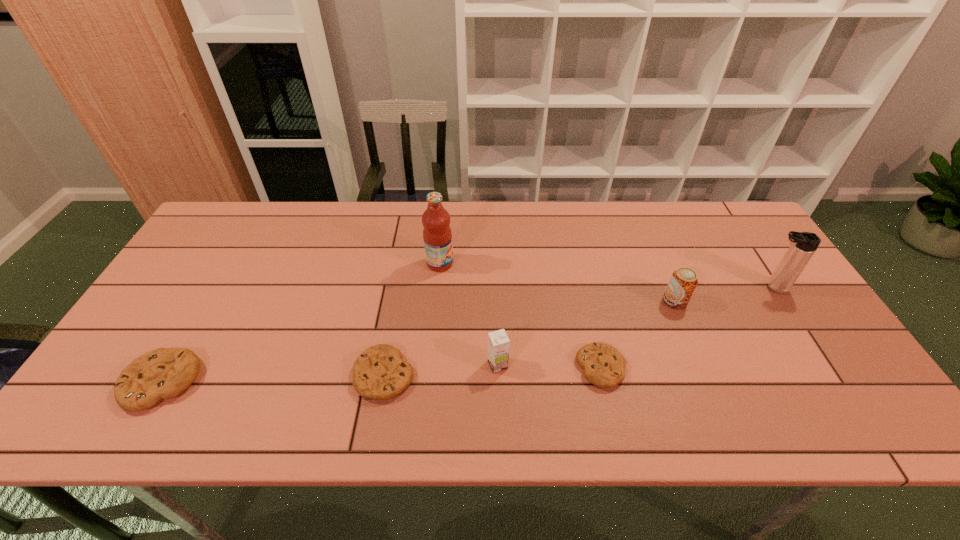
Identify the location of chocolate milk that is at the near edge. (498, 342).

Identify the location of object at the left edge. The image size is (960, 540). (164, 373).

Identify the location of object that is at the right edge. This screenshot has width=960, height=540. (803, 244).

At what (x,y) coordinates should I click in order to perform the action: click on object located at the near left corner. Please return your answer as a coordinate pair (x, y). Looking at the image, I should click on 164,373.

This screenshot has width=960, height=540. What are the coordinates of `vacant space at the far edge` in the screenshot? It's located at (603, 211).

The width and height of the screenshot is (960, 540). I want to click on vacant space at the near edge, so click(x=308, y=366).

In the image, there is a desktop. Where is `vacant area at the left edge`? vacant area at the left edge is located at coordinates (149, 319).

Where is `free space at the right edge of the desktop`? free space at the right edge of the desktop is located at coordinates pyautogui.click(x=826, y=355).

The image size is (960, 540). I want to click on free region at the far right corner, so click(727, 207).

The image size is (960, 540). Identify the location of empty location between the chocolate milk and the second tallest cookie. (441, 370).